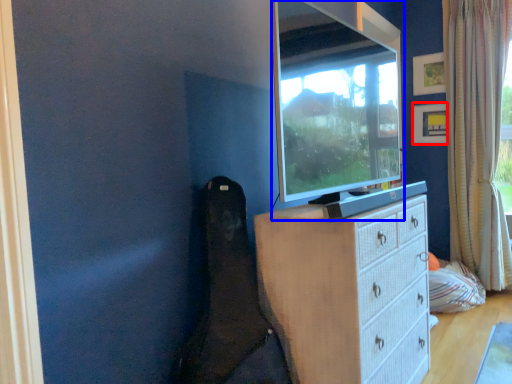
Question: Which object is further to the camera taking this photo, picture frame (highlighted by a red box) or television (highlighted by a blue box)?

Choices:
 (A) picture frame
 (B) television

Answer: (A)